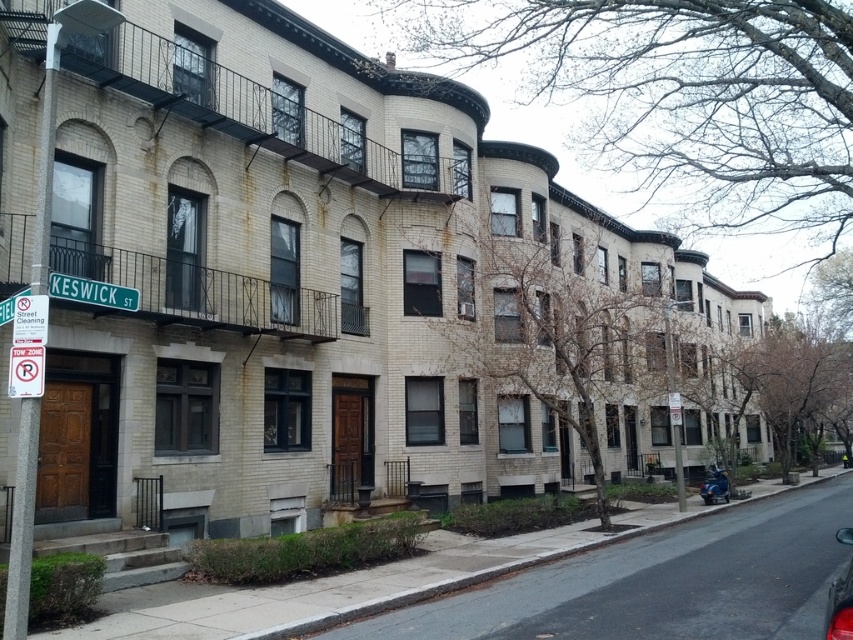
You are a delivery person who needs to park your shiny red car at lower right as close as possible to the red plastic sign at lower left without blocking the sidewalk. Given that the minimum distance required between parked vehicles and signs is 3 meters according to local regulations, is your current parking position compliant?

The distance between the shiny red car at lower right and the red plastic sign at lower left is 6.55 meters, which exceeds the 3 meter minimum requirement. Therefore, the parking position is compliant with local regulations.

You are a delivery person who needs to park your delivery van in this area. You see a shiny red car at lower right and a red plastic sign at lower left. According to the scene, which object is positioned to the right side of the other?

The shiny red car at lower right is to the right of the red plastic sign at lower left.

You are a delivery person approaching the entrance of the building on Keswick Street. You see a red plastic sign at lower left and a white paper sign at upper left. Which sign is closer to you as you approach the entrance?

The red plastic sign at lower left is closer to you because it is in front of the white paper sign at upper left.